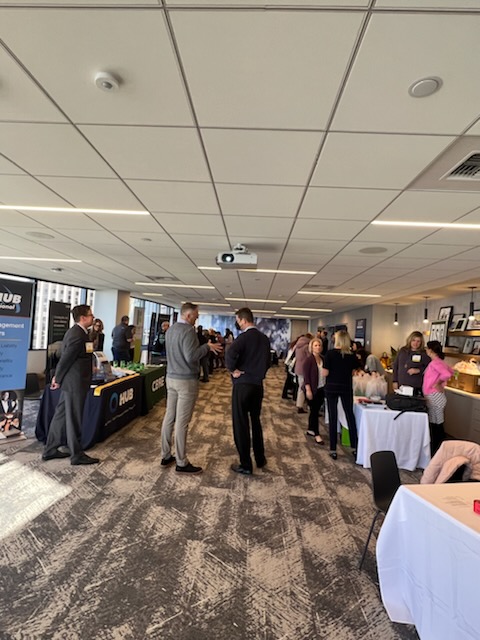
Locate an element on the screen. The image size is (480, 640). black chair is located at coordinates (384, 476).